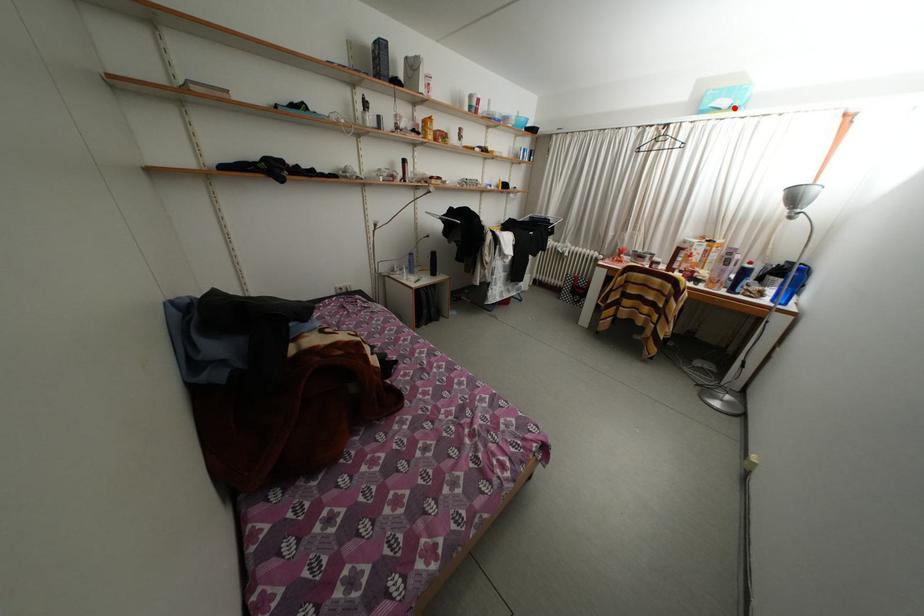
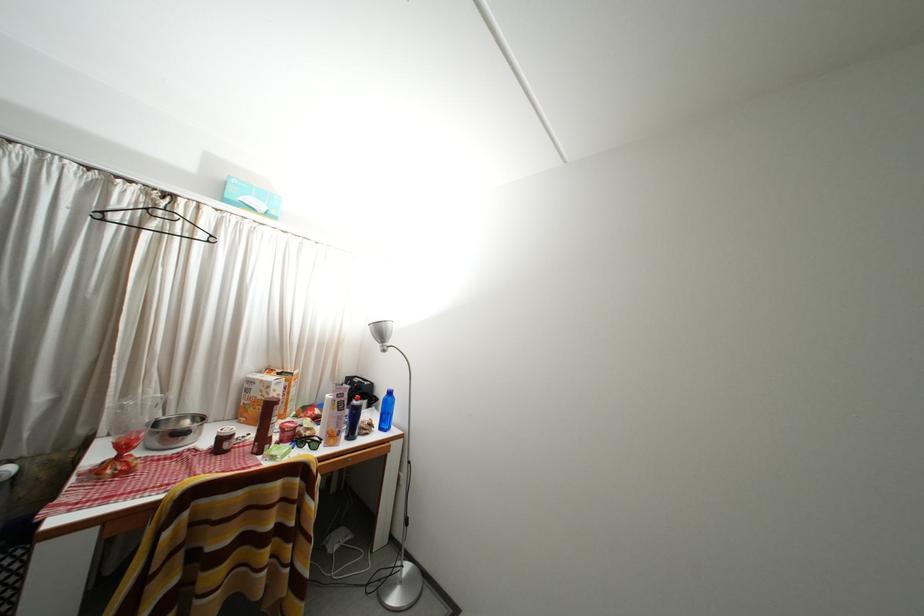
Find the pixel in the second image that matches the highlighted location in the first image.

(268, 211)